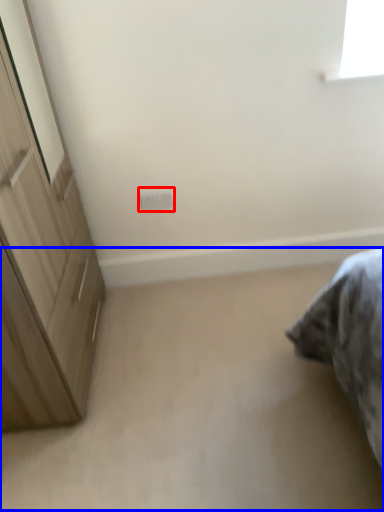
Question: Among these objects, which one is nearest to the camera, electric outlet (highlighted by a red box) or plain (highlighted by a blue box)?

Choices:
 (A) electric outlet
 (B) plain

Answer: (B)